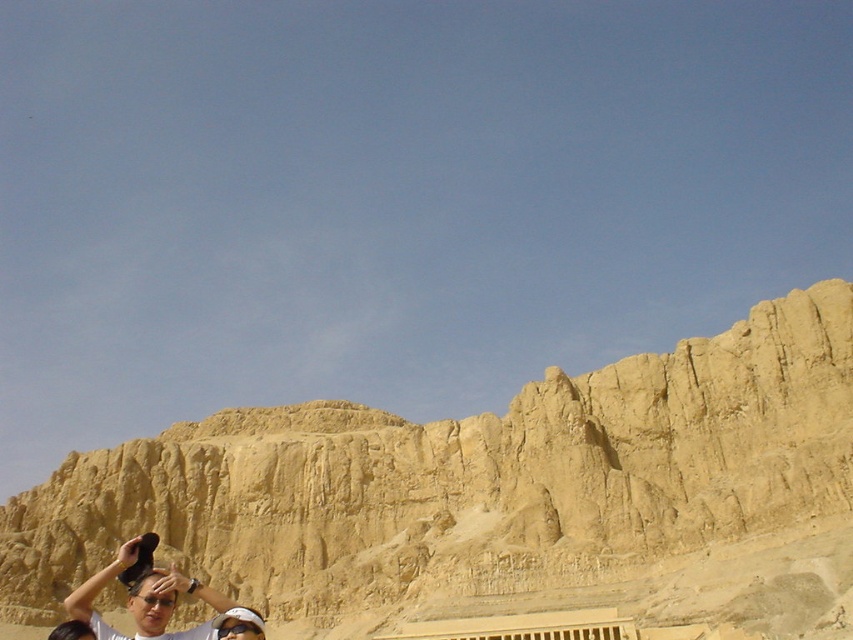
Question: Observing the image, what is the correct spatial positioning of yellow sandstone cliff at center in reference to matte black goggles at lower center?

Choices:
 (A) below
 (B) above

Answer: (A)

Question: Which object is the closest to the matte black hat at lower left?

Choices:
 (A) matte black goggles at lower center
 (B) yellow sandstone cliff at center

Answer: (A)

Question: Among these objects, which one is farthest from the camera?

Choices:
 (A) matte black hat at lower left
 (B) yellow sandstone cliff at center
 (C) matte black goggles at lower center

Answer: (B)

Question: Does yellow sandstone cliff at center have a smaller size compared to matte black goggles at lower center?

Choices:
 (A) no
 (B) yes

Answer: (A)

Question: Can you confirm if yellow sandstone cliff at center is positioned below matte black goggles at lower center?

Choices:
 (A) yes
 (B) no

Answer: (A)

Question: Which of these objects is positioned farthest from the matte black goggles at lower center?

Choices:
 (A) matte black hat at lower left
 (B) yellow sandstone cliff at center

Answer: (B)